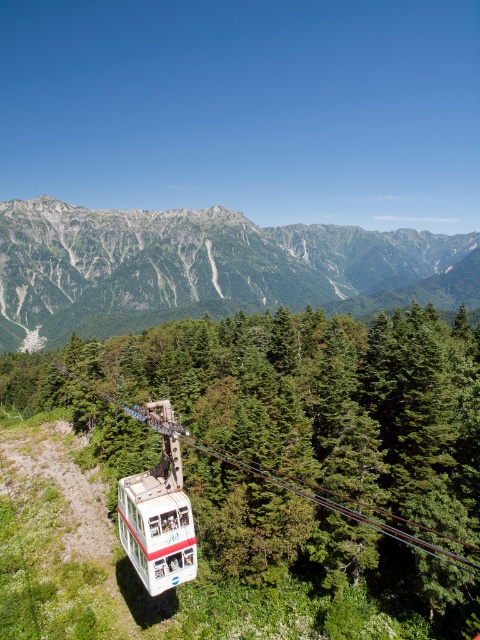
Is green textured mountain at center closer to the viewer compared to white matte cable car at center?

No, green textured mountain at center is behind white matte cable car at center.

Between green textured mountain at center and white matte cable car at center, which one appears on the left side from the viewer's perspective?

Positioned to the left is white matte cable car at center.

Is point (414, 298) more distant than point (181, 563)?

Yes, point (414, 298) is farther from viewer.

Where is `green textured mountain at center`? The width and height of the screenshot is (480, 640). green textured mountain at center is located at coordinates (206, 268).